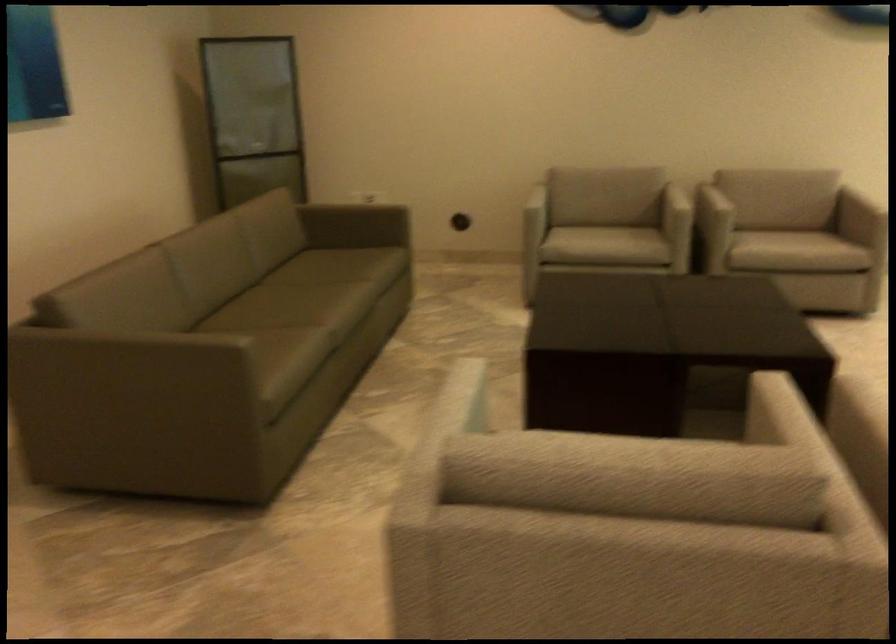
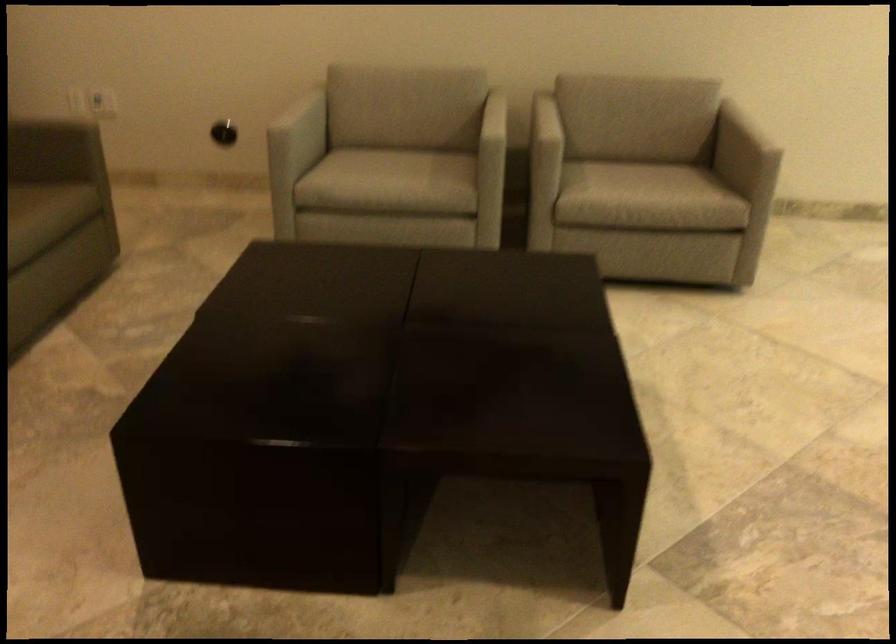
Where in the second image is the point corresponding to the point at 773,225 from the first image?

(633, 160)